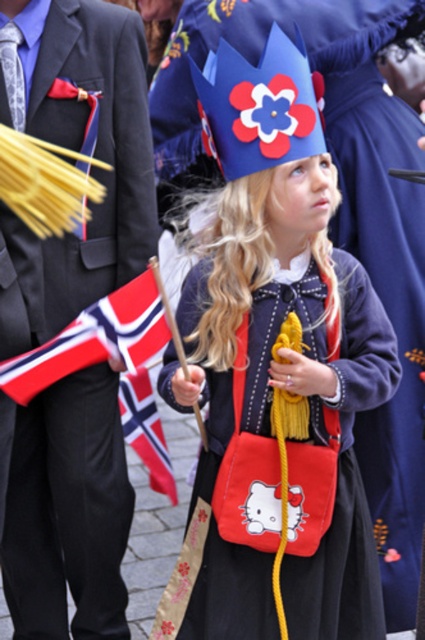
Question: Which of the following is the farthest from the observer?

Choices:
 (A) pyautogui.click(x=96, y=557)
 (B) pyautogui.click(x=124, y=416)
 (C) pyautogui.click(x=121, y=296)

Answer: (B)

Question: Based on their relative distances, which object is farther from the matte black suit at left?

Choices:
 (A) red and white fabric flag at lower left
 (B) red fabric flag at center
 (C) matte blue crown at center

Answer: (C)

Question: Which of the following is the closest to the observer?

Choices:
 (A) (14, 636)
 (B) (125, 436)
 (C) (277, 400)

Answer: (C)

Question: Can you confirm if red and white fabric flag at lower left is thinner than red fabric flag at center?

Choices:
 (A) yes
 (B) no

Answer: (B)

Question: Is matte blue crown at center above red and white fabric flag at lower left?

Choices:
 (A) no
 (B) yes

Answer: (B)

Question: Can you confirm if matte black suit at left is wider than red fabric flag at center?

Choices:
 (A) yes
 (B) no

Answer: (A)